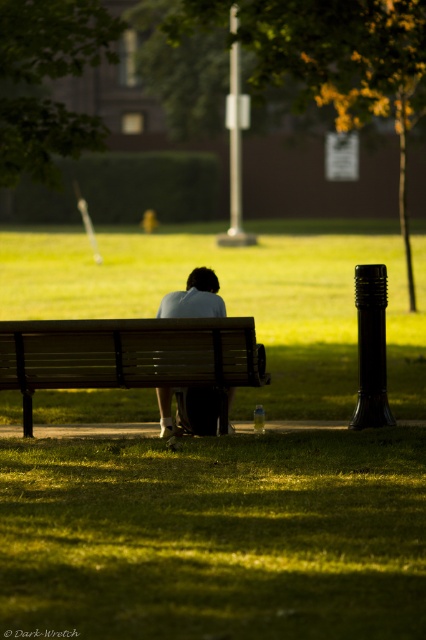
Question: Does green leafy tree at upper center appear under wooden bench at center?

Choices:
 (A) yes
 (B) no

Answer: (B)

Question: Considering the real-world distances, which object is closest to the green grass at lower center?

Choices:
 (A) green leafy tree at upper center
 (B) light blue fabric shirt at center
 (C) wooden bench at center

Answer: (C)

Question: Is wooden bench at center above green leafy tree at upper left?

Choices:
 (A) no
 (B) yes

Answer: (A)

Question: Does green leafy tree at upper left appear under light blue fabric shirt at center?

Choices:
 (A) yes
 (B) no

Answer: (B)

Question: Estimate the real-world distances between objects in this image. Which object is closer to the wooden bench at center?

Choices:
 (A) green leafy tree at upper left
 (B) green leafy tree at upper center

Answer: (A)

Question: Which point is farther from the camera taking this photo?

Choices:
 (A) (28, 84)
 (B) (276, 24)
 (C) (215, 589)

Answer: (A)